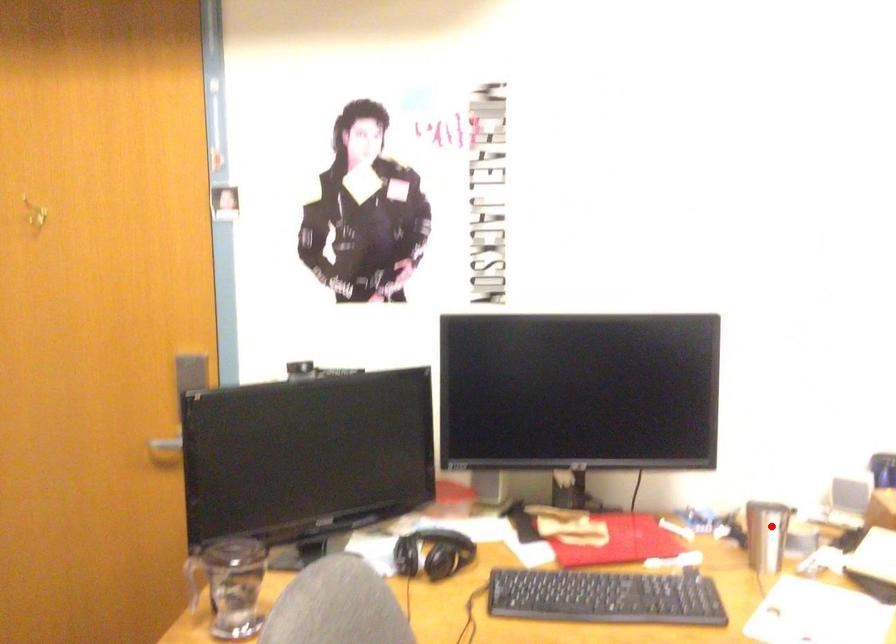
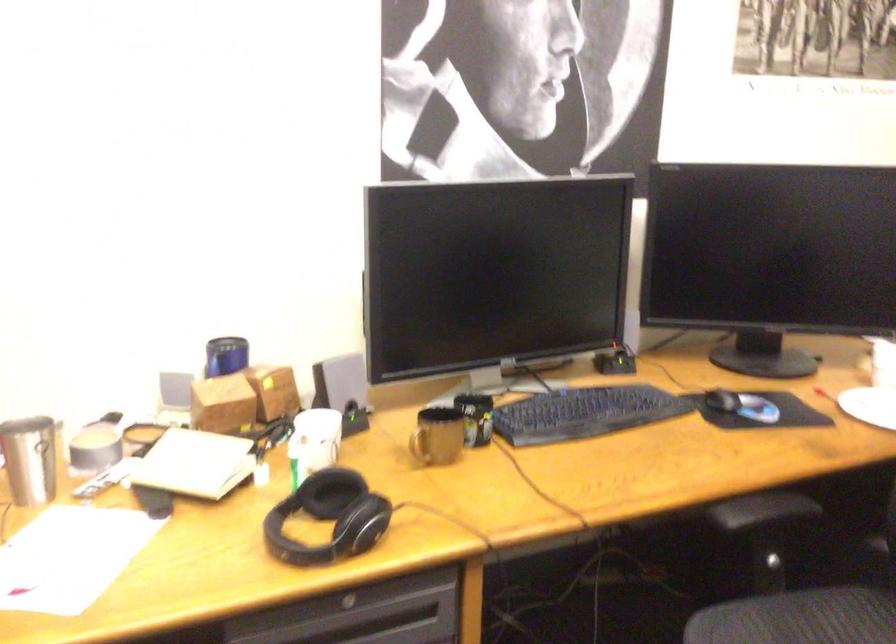
In the second image, find the point that corresponds to the highlighted location in the first image.

(30, 459)